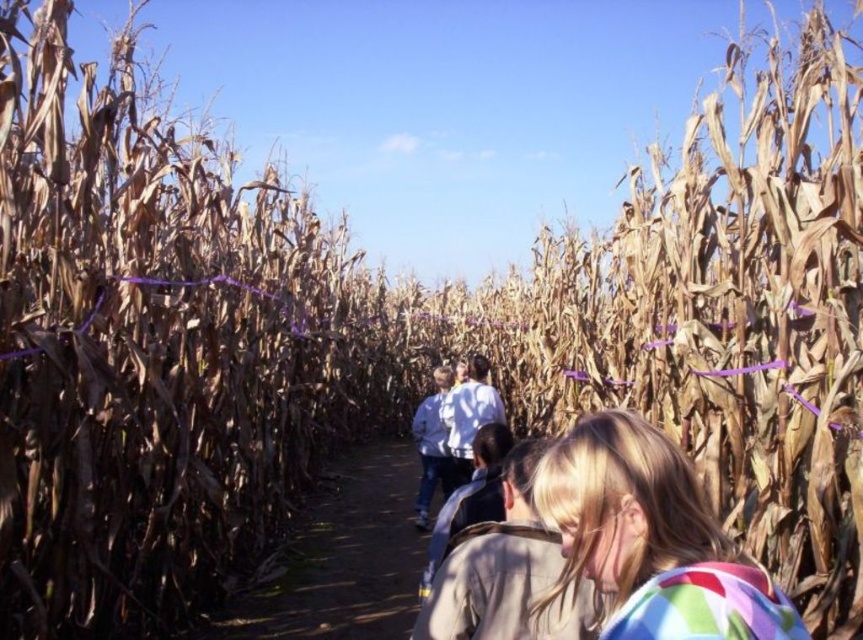
Question: Can you confirm if dirt path at center is wider than light blue denim jacket at center?

Choices:
 (A) no
 (B) yes

Answer: (A)

Question: Is multicolored fabric at lower right below blonde hair at center?

Choices:
 (A) yes
 (B) no

Answer: (B)

Question: Among these points, which one is nearest to the camera?

Choices:
 (A) (306, 598)
 (B) (618, 502)
 (C) (439, 625)
 (D) (433, 397)

Answer: (B)

Question: Estimate the real-world distances between objects in this image. Which object is closer to the dirt path at center?

Choices:
 (A) light blue denim jacket at center
 (B) blonde hair at center
 (C) multicolored fabric at lower right

Answer: (B)

Question: Considering the relative positions of multicolored fabric at lower right and light blue denim jacket at center in the image provided, where is multicolored fabric at lower right located with respect to light blue denim jacket at center?

Choices:
 (A) below
 (B) above

Answer: (B)

Question: Which point is farther to the camera?

Choices:
 (A) (424, 406)
 (B) (570, 500)
 (C) (356, 577)
 (D) (528, 541)

Answer: (A)